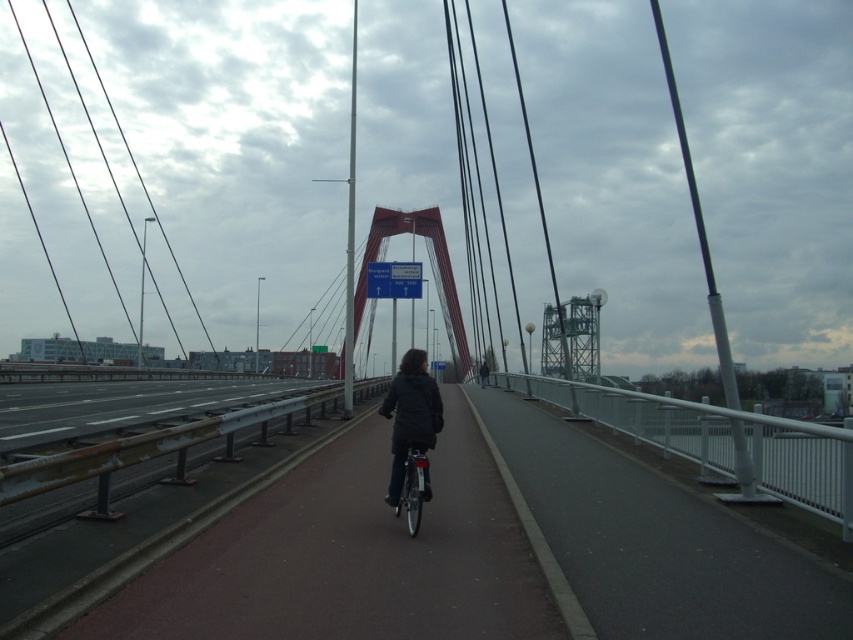
You are a pedestrian standing on the bridge and see a dark matte jacket at center and a white plastic sign at center. Which object is closer to you?

The dark matte jacket at center is closer to you because it is in front of the white plastic sign at center.

You are standing on the bridge and want to reach a specific point marked as point (x=372, y=284). If your walking speed is 1.5 meters per second, how many seconds will it take you to reach the point?

The point (x=372, y=284) is 39.97 meters from the viewer. At a walking speed of 1.5 meters per second, it would take approximately 26.65 seconds to reach the point.